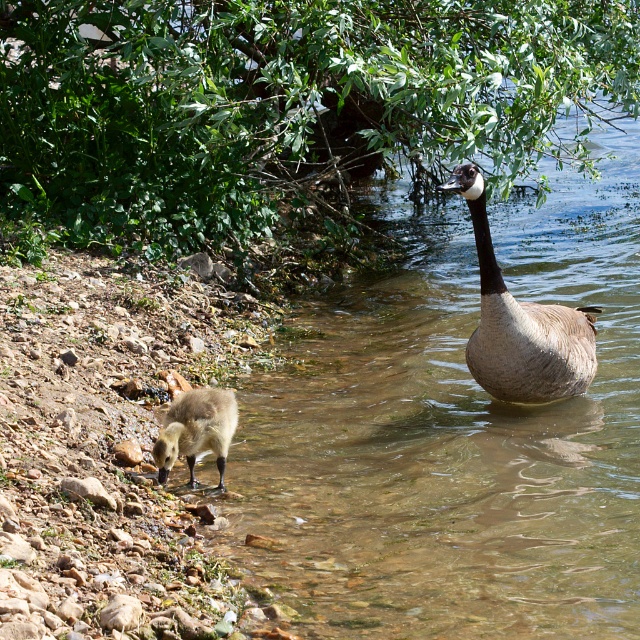
You are a photographer trying to capture a photo of the clear water at goose right and the brown feathered goose at right. Based on their heights, which object would appear closer to the camera in the photo?

The brown feathered goose at right is taller than the clear water at goose right, so the brown feathered goose at right would appear closer to the camera in the photo.

You are a wildlife photographer aiming to capture both the brown feathered goose at right and the brown fuzzy duckling at lower left in a single frame. Based on their positions and sizes, which animal should you focus on first to ensure both are visible in the photo?

The brown feathered goose at right is taller than the brown fuzzy duckling at lower left. To ensure both are visible in the photo, focus on the brown feathered goose at right first, as its greater height may require adjusting the camera angle to include its full form while still capturing the smaller duckling in the frame.